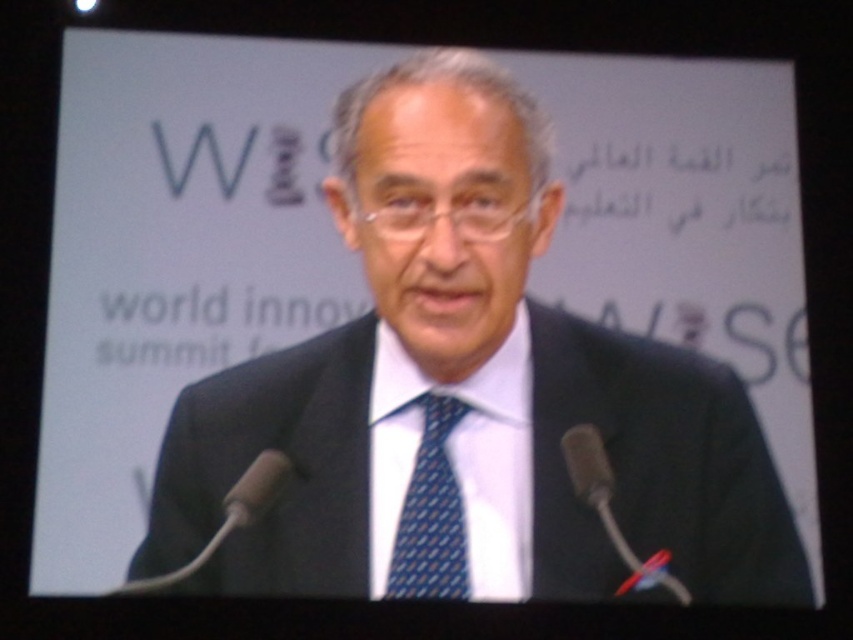
Question: Can you confirm if blue dotted tie at center is positioned above black plastic microphone at lower left?

Choices:
 (A) yes
 (B) no

Answer: (A)

Question: Which point appears closest to the camera in this image?

Choices:
 (A) (374, 474)
 (B) (685, 589)
 (C) (120, 593)
 (D) (395, 548)

Answer: (D)

Question: Is black silk suit at center smaller than blue dotted tie at center?

Choices:
 (A) no
 (B) yes

Answer: (A)

Question: Is blue dotted tie at center smaller than metallic silver microphone at center?

Choices:
 (A) no
 (B) yes

Answer: (B)

Question: Among these objects, which one is farthest from the camera?

Choices:
 (A) black plastic microphone at lower left
 (B) black silk suit at center

Answer: (A)

Question: Which point is farther from the camera taking this photo?

Choices:
 (A) (440, 428)
 (B) (508, 420)
 (C) (262, 452)
 (D) (672, 579)

Answer: (B)